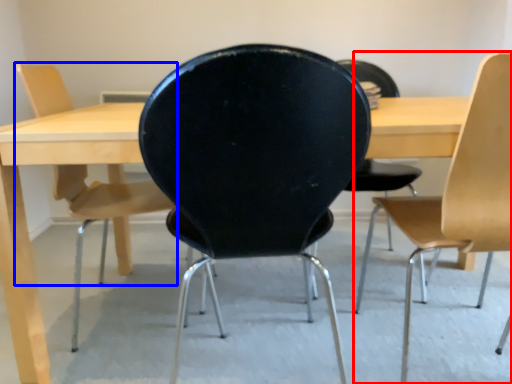
Question: Among these objects, which one is nearest to the camera, chair (highlighted by a red box) or chair (highlighted by a blue box)?

Choices:
 (A) chair
 (B) chair

Answer: (A)